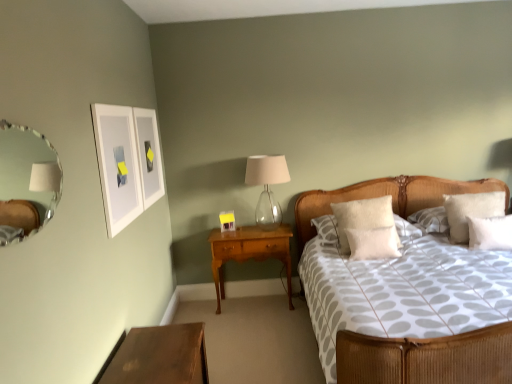
Find the location of a particular element. free region under wooden nightstand at center, placed as the 1th nightstand when sorted from back to front (from a real-world perspective) is located at coordinates point(257,302).